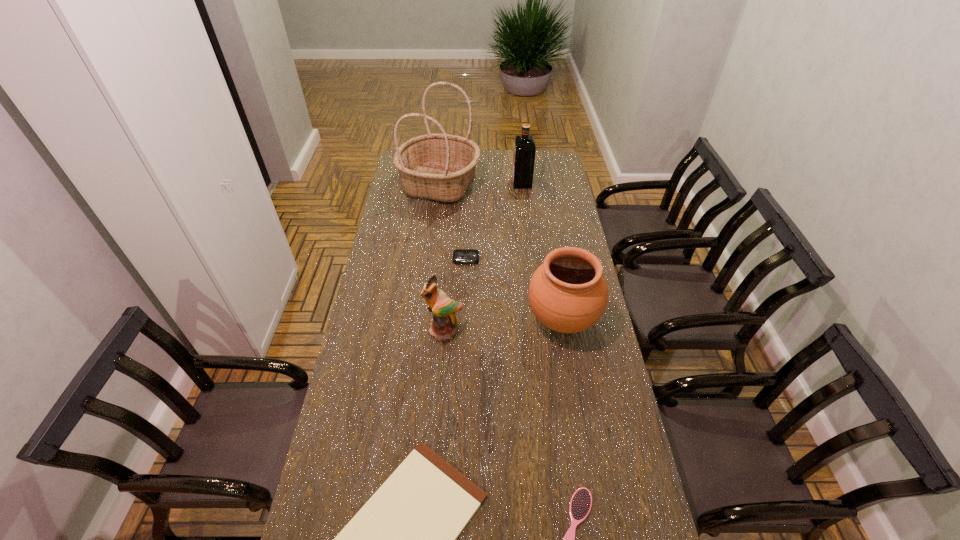
At what (x,y) coordinates should I click in order to perform the action: click on vacant area that lies between the third farthest object and the parrot. Please return your answer as a coordinate pair (x, y). Looking at the image, I should click on (455, 295).

Where is `vacant space that is in between the fifth nearest object and the pottery`? This screenshot has height=540, width=960. vacant space that is in between the fifth nearest object and the pottery is located at coordinates (515, 290).

At what (x,y) coordinates should I click in order to perform the action: click on vacant space that's between the pottery and the parrot. Please return your answer as a coordinate pair (x, y). Image resolution: width=960 pixels, height=540 pixels. Looking at the image, I should click on (503, 326).

What are the coordinates of `the closest object to the liquor` in the screenshot? It's located at (440, 167).

Locate which object ranks sixth in proximity to the third farthest object. Please provide its 2D coordinates. Your answer should be formatted as a tuple, i.e. [(x, y)], where the tuple contains the x and y coordinates of a point satisfying the conditions above.

[(581, 502)]

Where is `vacant space that satisfies the following two spatial constraints: 1. on the front label of the liquor; 2. on the display of the alarm clock`? vacant space that satisfies the following two spatial constraints: 1. on the front label of the liquor; 2. on the display of the alarm clock is located at coordinates (531, 259).

Identify the location of vacant space that satisfies the following two spatial constraints: 1. on the display of the alarm clock; 2. on the left side of the pottery. (465, 320).

Identify the location of free space that satisfies the following two spatial constraints: 1. on the front label of the liquor; 2. on the front-facing side of the parrot. (540, 331).